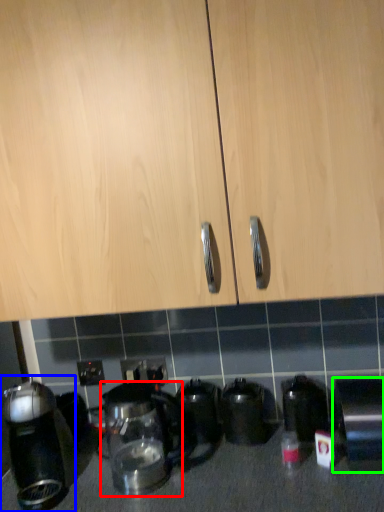
Question: Which object is positioned closest to kitchen appliance (highlighted by a red box)? Select from kitchen appliance (highlighted by a blue box) and kitchen appliance (highlighted by a green box).

Choices:
 (A) kitchen appliance
 (B) kitchen appliance

Answer: (A)